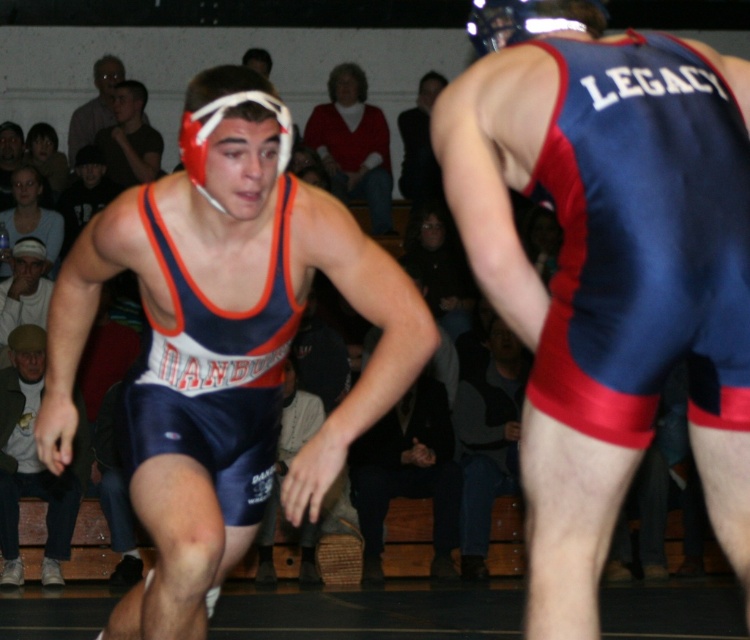
Question: Among these objects, which one is farthest from the camera?

Choices:
 (A) matte white headgear at upper center
 (B) matte black headgear at upper left
 (C) matte blue singlet at lower left

Answer: (B)

Question: Which object is positioned closest to the blue fabric singlet at center?

Choices:
 (A) matte black headgear at upper left
 (B) white cotton cap at lower left

Answer: (B)

Question: Is matte red sweater at center further to camera compared to blue fabric singlet at center?

Choices:
 (A) yes
 (B) no

Answer: (A)

Question: Is matte blue singlet at lower left bigger than matte red sweater at center?

Choices:
 (A) yes
 (B) no

Answer: (A)

Question: Which point appears farthest from the camera in this image?

Choices:
 (A) (555, 483)
 (B) (80, 444)
 (C) (312, 563)
 (D) (16, 305)

Answer: (D)

Question: Is blue satin singlet at center to the right of matte white headgear at upper center from the viewer's perspective?

Choices:
 (A) yes
 (B) no

Answer: (A)